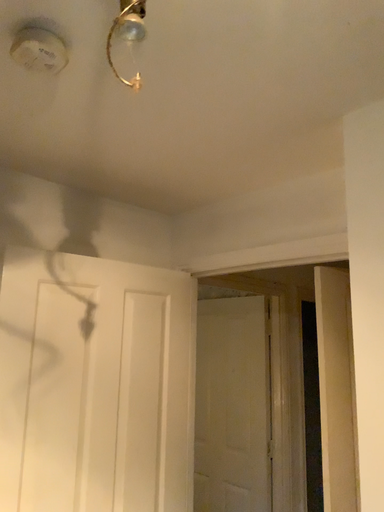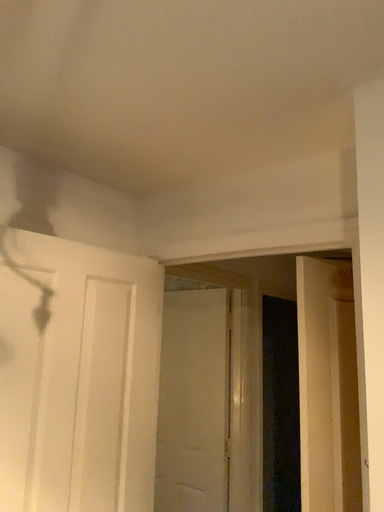
Question: How did the camera likely rotate when shooting the video?

Choices:
 (A) rotated left
 (B) rotated right

Answer: (B)